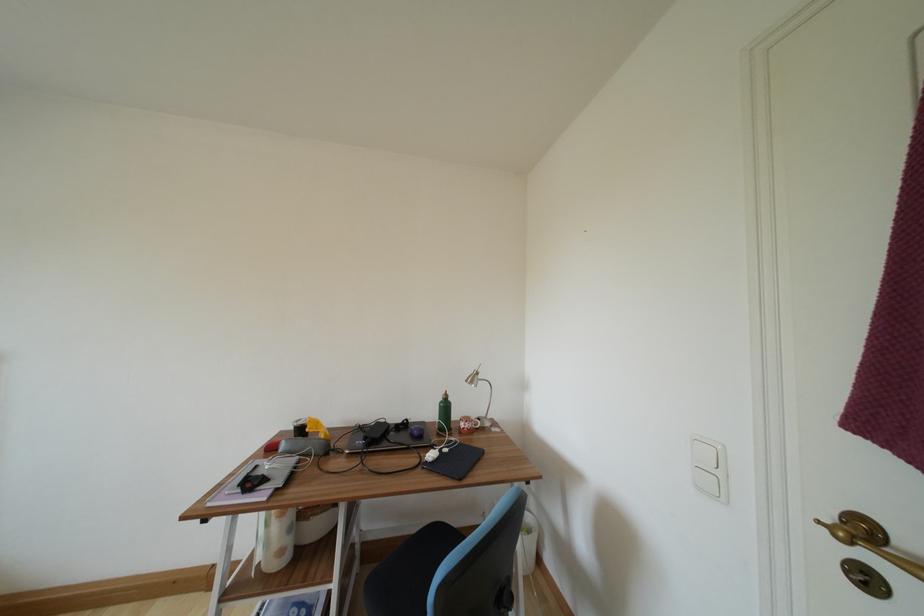
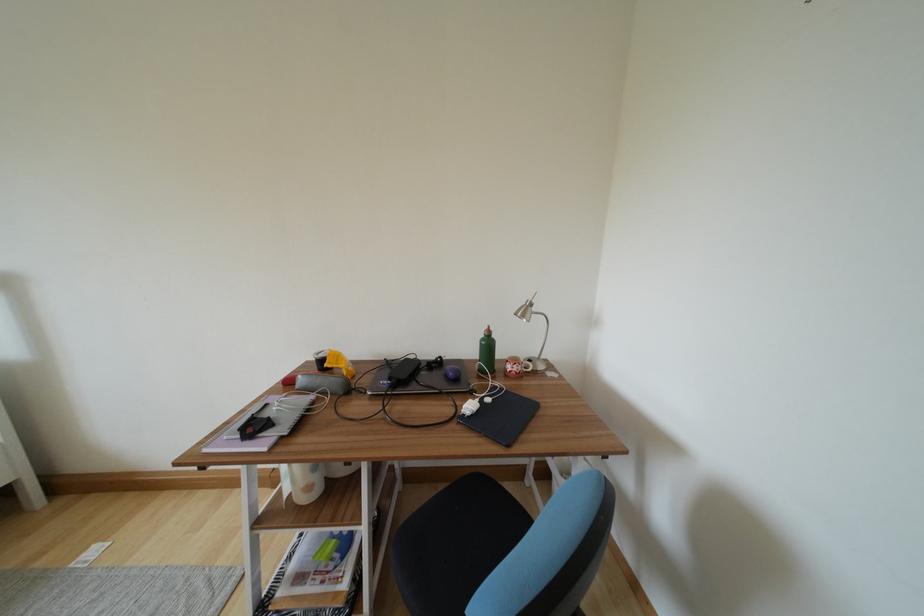
In the second image, find the point that corresponds to (x=370, y=442) in the first image.

(395, 382)